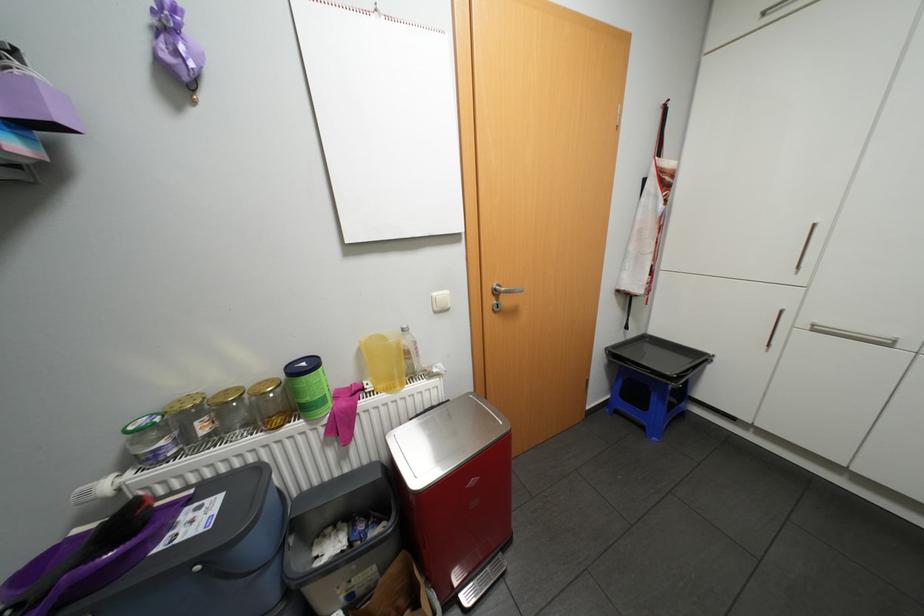
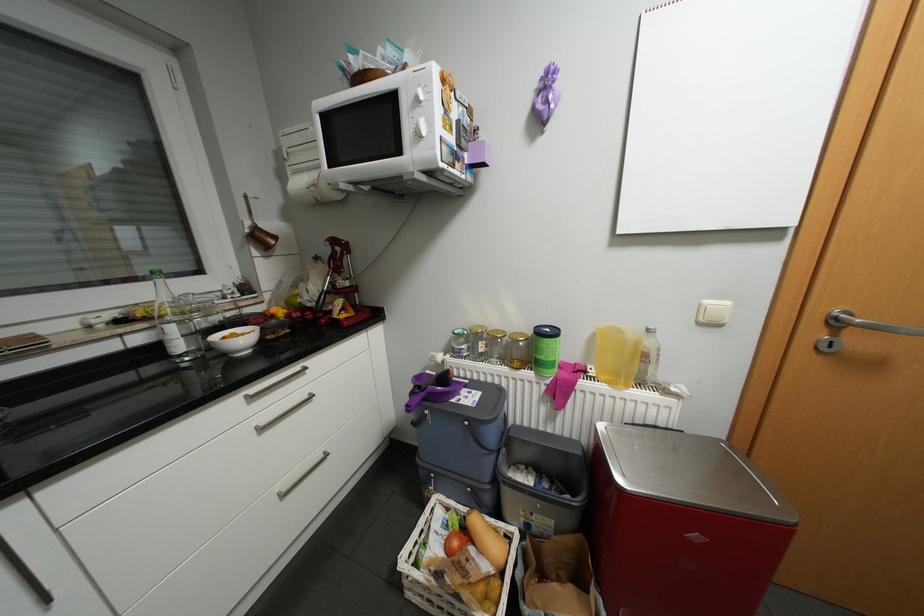
Question: Based on the continuous images, in which direction is the camera rotating? Reply with the corresponding letter.

Choices:
 (A) Left
 (B) Right
 (C) Up
 (D) Down

Answer: (A)